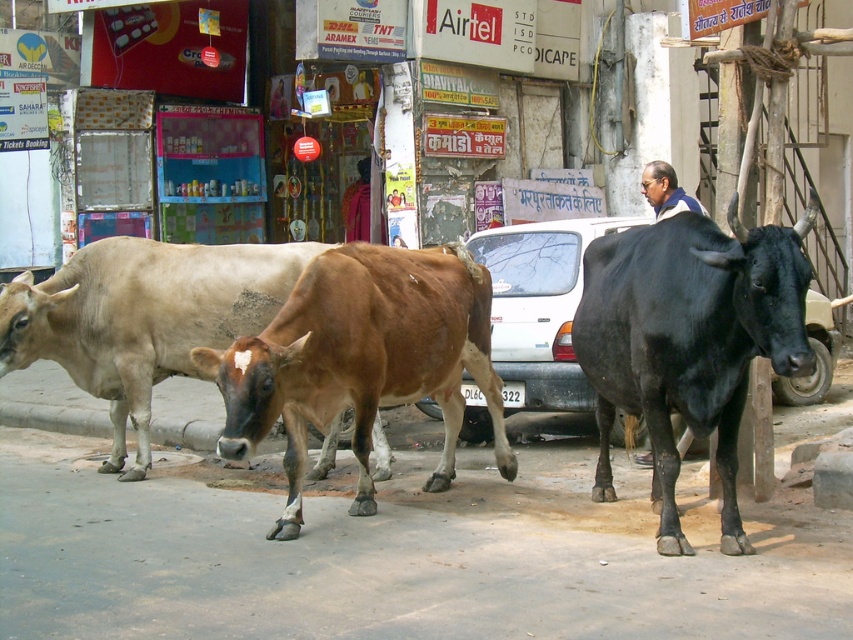
Question: Does brown matte cow at center have a lesser width compared to blue and white shirt at center?

Choices:
 (A) yes
 (B) no

Answer: (B)

Question: Estimate the real-world distances between objects in this image. Which object is closer to the black glossy bull at right?

Choices:
 (A) dark blue shirt at center
 (B) brown glossy cow at center

Answer: (B)

Question: Based on their relative distances, which object is farther from the brown matte cow at center?

Choices:
 (A) white matte car at center
 (B) brown glossy cow at center
 (C) blue and white shirt at center
 (D) black glossy bull at right

Answer: (C)

Question: Observing the image, what is the correct spatial positioning of brown matte cow at center in reference to white matte car at center?

Choices:
 (A) above
 (B) below

Answer: (B)

Question: Which point is closer to the camera?

Choices:
 (A) black glossy bull at right
 (B) brown matte cow at center
 (C) brown glossy cow at center
 (D) white matte car at center

Answer: (A)

Question: Is black glossy bull at right positioned at the back of white matte car at center?

Choices:
 (A) no
 (B) yes

Answer: (A)